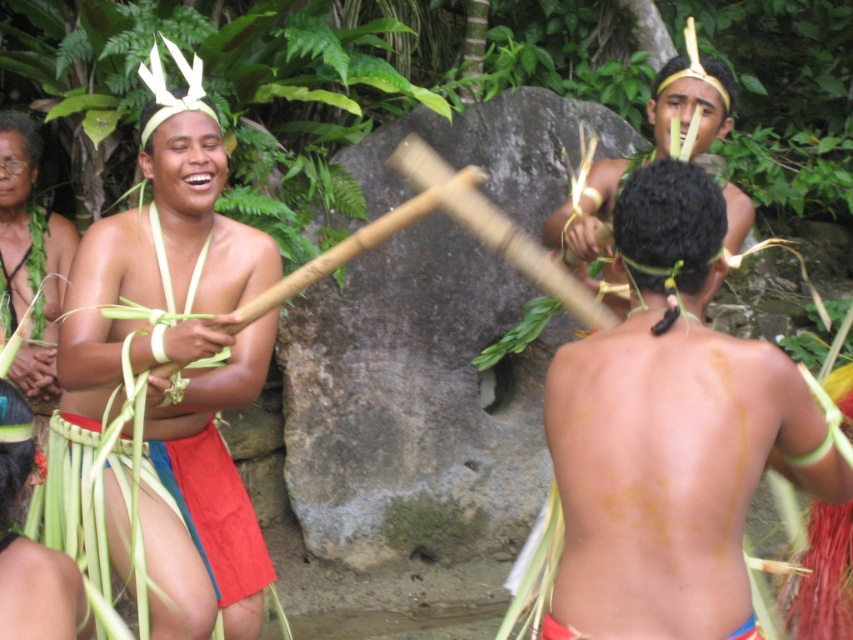
Question: Can you confirm if smooth skin at center is positioned below smooth brown wooden stick at center?

Choices:
 (A) no
 (B) yes

Answer: (B)

Question: Which point is closer to the camera taking this photo?

Choices:
 (A) (612, 442)
 (B) (662, 84)

Answer: (A)

Question: Does smooth skin at center appear over smooth brown wooden stick at center?

Choices:
 (A) no
 (B) yes

Answer: (A)

Question: Can you confirm if smooth skin at center is smaller than smooth brown wooden stick at center?

Choices:
 (A) no
 (B) yes

Answer: (B)